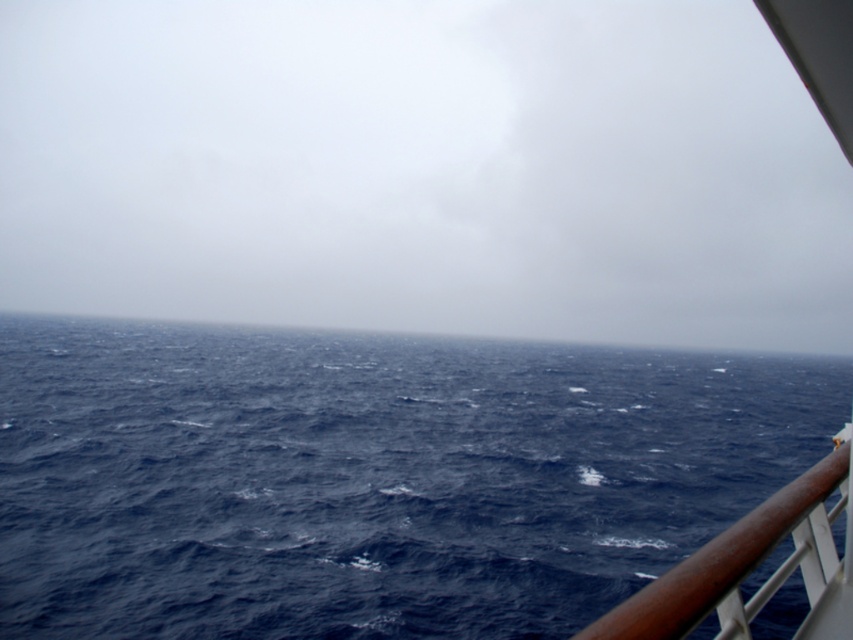
You are standing on the deck of a ship and see the dark blue water at center and the brown polished wood at right. Which object is located to the right side of the other?

The dark blue water at center is to the right of brown polished wood at right according to the description.